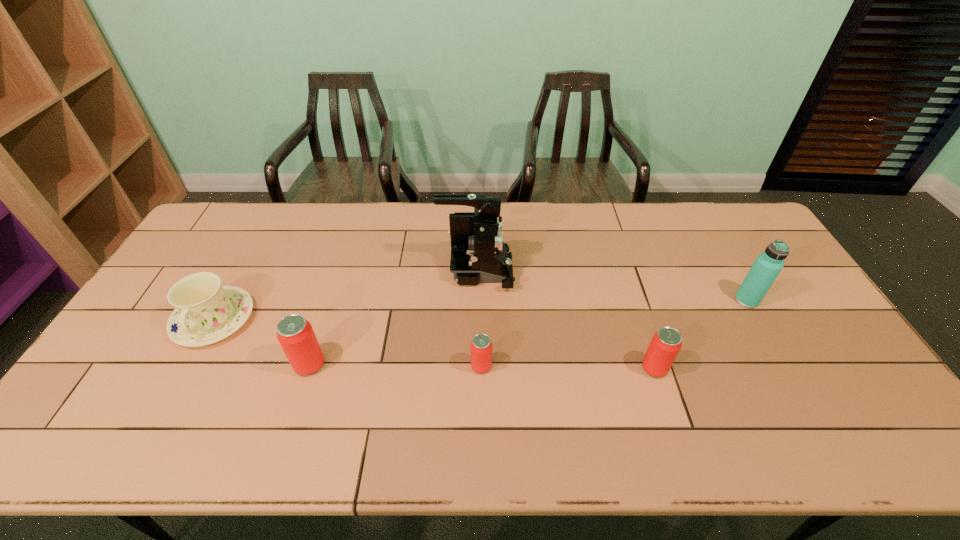
The image size is (960, 540). Find the location of `blank space located 0.350m on the left of the leftmost beer can`. blank space located 0.350m on the left of the leftmost beer can is located at coordinates (161, 364).

The height and width of the screenshot is (540, 960). Identify the location of vacant region located 0.290m on the back of the second beer can from right to left. (481, 280).

Where is `free point located 0.300m on the left of the rightmost beer can`? The height and width of the screenshot is (540, 960). free point located 0.300m on the left of the rightmost beer can is located at coordinates pyautogui.click(x=526, y=368).

Find the location of a particular element. The image size is (960, 540). free space located on the handle side of the chinaware is located at coordinates (164, 410).

At what (x,y) coordinates should I click in order to perform the action: click on vacant space located on the lens mount of the camcorder. Please return your answer as a coordinate pair (x, y). Image resolution: width=960 pixels, height=540 pixels. Looking at the image, I should click on [588, 271].

This screenshot has height=540, width=960. What are the coordinates of `blank area located on the back of the rightmost object` in the screenshot? It's located at (732, 276).

Image resolution: width=960 pixels, height=540 pixels. Identify the location of object that is at the left edge. (206, 312).

You are a GUI agent. You are given a task and a screenshot of the screen. Output one action in this format:
    pyautogui.click(x=<x>, y=<y>)
    Task: Click on the object present at the right edge
    This screenshot has width=960, height=540.
    Given the screenshot: What is the action you would take?
    pyautogui.click(x=767, y=266)

This screenshot has width=960, height=540. Find the location of `vacant region at the far edge of the desktop`. vacant region at the far edge of the desktop is located at coordinates (566, 239).

Locate an element on the screen. The image size is (960, 540). free region at the near edge of the desktop is located at coordinates (483, 395).